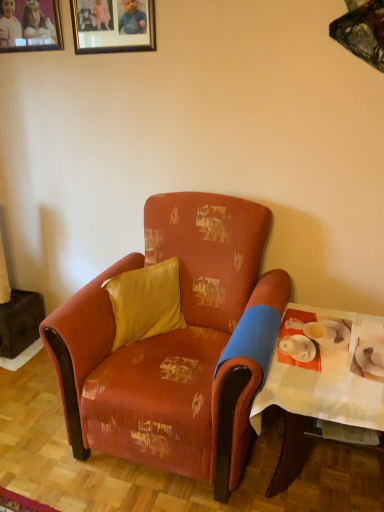
The width and height of the screenshot is (384, 512). Describe the element at coordinates (113, 25) in the screenshot. I see `gold-framed picture at upper center, marked as the 1th picture frame in a right-to-left arrangement` at that location.

The height and width of the screenshot is (512, 384). What do you see at coordinates (145, 302) in the screenshot?
I see `satin yellow pillow at center` at bounding box center [145, 302].

The image size is (384, 512). Identify the location of white paper table at right. click(x=322, y=387).

This screenshot has width=384, height=512. What are the coordinates of `gold-framed picture at upper center, marked as the 1th picture frame in a right-to-left arrangement` in the screenshot? It's located at (113, 25).

Would you say satin yellow pillow at center is inside or outside distressed fabric armchair at center?

satin yellow pillow at center fits inside distressed fabric armchair at center.

Which of these two, satin yellow pillow at center or distressed fabric armchair at center, is bigger?

distressed fabric armchair at center is bigger.

From the picture: Is distressed fabric armchair at center at the back of satin yellow pillow at center?

That's right, satin yellow pillow at center is facing away from distressed fabric armchair at center.

Looking at this image, between satin yellow pillow at center and distressed fabric armchair at center, which one has smaller width?

satin yellow pillow at center.

Which of these two, gold-framed picture at upper center, marked as the 1th picture frame in a right-to-left arrangement, or white paper table at right, is bigger?

white paper table at right is bigger.

Which is more to the right, gold-framed picture at upper center, marked as the 1th picture frame in a right-to-left arrangement, or white paper table at right?

From the viewer's perspective, white paper table at right appears more on the right side.

Is gold-framed picture at upper center, marked as the 1th picture frame in a right-to-left arrangement, taller or shorter than white paper table at right?

gold-framed picture at upper center, marked as the 1th picture frame in a right-to-left arrangement, is shorter than white paper table at right.

Which of these two, gold-framed picture at upper center, marked as the 1th picture frame in a right-to-left arrangement, or distressed fabric armchair at center, is wider?

With larger width is distressed fabric armchair at center.

Image resolution: width=384 pixels, height=512 pixels. Find the location of `the 1st picture frame behind when counting from the distressed fabric armchair at center`. the 1st picture frame behind when counting from the distressed fabric armchair at center is located at coordinates (113, 25).

Would you say distressed fabric armchair at center is part of gold-framed picture at upper center, marked as the 1th picture frame in a right-to-left arrangement,'s contents?

That's incorrect, distressed fabric armchair at center is not inside gold-framed picture at upper center, marked as the 1th picture frame in a right-to-left arrangement.

Does gold-framed picture at upper center, placed as the 2th picture frame when sorted from left to right, appear on the left side of distressed fabric armchair at center?

Yes.

From the image's perspective, which is above, matte wooden picture frame at upper left, the 1th picture frame when ordered from left to right, or distressed fabric armchair at center?

matte wooden picture frame at upper left, the 1th picture frame when ordered from left to right, is shown above in the image.

Identify the location of the 2nd picture frame behind the distressed fabric armchair at center, starting your count from the anchor. (30, 26).

Which object is closer to the camera taking this photo, matte wooden picture frame at upper left, arranged as the second picture frame when viewed from the right, or distressed fabric armchair at center?

distressed fabric armchair at center.

Does matte wooden picture frame at upper left, the 1th picture frame when ordered from left to right, turn towards distressed fabric armchair at center?

No, matte wooden picture frame at upper left, the 1th picture frame when ordered from left to right, is not facing towards distressed fabric armchair at center.

Can you confirm if white paper table at right is wider than gold-framed picture at upper center, marked as the 1th picture frame in a right-to-left arrangement?

Correct, the width of white paper table at right exceeds that of gold-framed picture at upper center, marked as the 1th picture frame in a right-to-left arrangement.

From the image's perspective, who appears lower, white paper table at right or gold-framed picture at upper center, marked as the 1th picture frame in a right-to-left arrangement?

white paper table at right, from the image's perspective.

Looking at this image, is white paper table at right at the left side of gold-framed picture at upper center, placed as the 2th picture frame when sorted from left to right?

In fact, white paper table at right is to the right of gold-framed picture at upper center, placed as the 2th picture frame when sorted from left to right.

Relative to gold-framed picture at upper center, marked as the 1th picture frame in a right-to-left arrangement, is satin yellow pillow at center in front or behind?

satin yellow pillow at center is in front of gold-framed picture at upper center, marked as the 1th picture frame in a right-to-left arrangement.

Does satin yellow pillow at center turn towards gold-framed picture at upper center, marked as the 1th picture frame in a right-to-left arrangement?

No, satin yellow pillow at center does not turn towards gold-framed picture at upper center, marked as the 1th picture frame in a right-to-left arrangement.

Is satin yellow pillow at center taller or shorter than gold-framed picture at upper center, marked as the 1th picture frame in a right-to-left arrangement?

In the image, satin yellow pillow at center appears to be shorter than gold-framed picture at upper center, marked as the 1th picture frame in a right-to-left arrangement.

Does satin yellow pillow at center have a greater width compared to gold-framed picture at upper center, marked as the 1th picture frame in a right-to-left arrangement?

Correct, the width of satin yellow pillow at center exceeds that of gold-framed picture at upper center, marked as the 1th picture frame in a right-to-left arrangement.

Measure the distance from matte wooden picture frame at upper left, the 1th picture frame when ordered from left to right, to white paper table at right.

The distance of matte wooden picture frame at upper left, the 1th picture frame when ordered from left to right, from white paper table at right is 2.00 meters.

The width and height of the screenshot is (384, 512). I want to click on table located underneath the matte wooden picture frame at upper left, arranged as the second picture frame when viewed from the right (from a real-world perspective), so [322, 387].

Which of these two, matte wooden picture frame at upper left, arranged as the second picture frame when viewed from the right, or white paper table at right, is smaller?

matte wooden picture frame at upper left, arranged as the second picture frame when viewed from the right.

Does matte wooden picture frame at upper left, arranged as the second picture frame when viewed from the right, have a greater height compared to white paper table at right?

In fact, matte wooden picture frame at upper left, arranged as the second picture frame when viewed from the right, may be shorter than white paper table at right.

Locate an element on the screen. Image resolution: width=384 pixels, height=512 pixels. pillow to the left of distressed fabric armchair at center is located at coordinates (145, 302).

Locate an element on the screen. table that appears in front of the gold-framed picture at upper center, placed as the 2th picture frame when sorted from left to right is located at coordinates (322, 387).

Based on their spatial positions, is matte wooden picture frame at upper left, arranged as the second picture frame when viewed from the right, or gold-framed picture at upper center, placed as the 2th picture frame when sorted from left to right, closer to satin yellow pillow at center?

gold-framed picture at upper center, placed as the 2th picture frame when sorted from left to right, is closer to satin yellow pillow at center.

Based on their spatial positions, is matte wooden picture frame at upper left, the 1th picture frame when ordered from left to right, or satin yellow pillow at center further from white paper table at right?

matte wooden picture frame at upper left, the 1th picture frame when ordered from left to right, lies further to white paper table at right than the other object.

Considering their positions, is matte wooden picture frame at upper left, the 1th picture frame when ordered from left to right, positioned closer to satin yellow pillow at center than white paper table at right?

white paper table at right.

Estimate the real-world distances between objects in this image. Which object is further from gold-framed picture at upper center, marked as the 1th picture frame in a right-to-left arrangement, satin yellow pillow at center or matte wooden picture frame at upper left, arranged as the second picture frame when viewed from the right?

satin yellow pillow at center is positioned further to the anchor gold-framed picture at upper center, marked as the 1th picture frame in a right-to-left arrangement.

Which object lies further to the anchor point distressed fabric armchair at center, satin yellow pillow at center or white paper table at right?

white paper table at right lies further to distressed fabric armchair at center than the other object.

When comparing their distances from gold-framed picture at upper center, marked as the 1th picture frame in a right-to-left arrangement, does white paper table at right or matte wooden picture frame at upper left, the 1th picture frame when ordered from left to right, seem closer?

The object closer to gold-framed picture at upper center, marked as the 1th picture frame in a right-to-left arrangement, is matte wooden picture frame at upper left, the 1th picture frame when ordered from left to right.

Based on their spatial positions, is distressed fabric armchair at center or gold-framed picture at upper center, placed as the 2th picture frame when sorted from left to right, further from white paper table at right?

Among the two, gold-framed picture at upper center, placed as the 2th picture frame when sorted from left to right, is located further to white paper table at right.

Considering their positions, is satin yellow pillow at center positioned closer to white paper table at right than gold-framed picture at upper center, marked as the 1th picture frame in a right-to-left arrangement?

satin yellow pillow at center.

Locate an element on the screen. This screenshot has height=512, width=384. pillow between gold-framed picture at upper center, marked as the 1th picture frame in a right-to-left arrangement, and white paper table at right from top to bottom is located at coordinates (145, 302).

You are a GUI agent. You are given a task and a screenshot of the screen. Output one action in this format:
    pyautogui.click(x=<x>, y=<y>)
    Task: Click on the pillow between matte wooden picture frame at upper left, arranged as the second picture frame when viewed from the right, and white paper table at right in the up-down direction
    The image size is (384, 512).
    Given the screenshot: What is the action you would take?
    pyautogui.click(x=145, y=302)

The width and height of the screenshot is (384, 512). In order to click on chair between matte wooden picture frame at upper left, the 1th picture frame when ordered from left to right, and white paper table at right from top to bottom in this screenshot , I will do pos(174,342).

Find the location of `chair between gold-framed picture at upper center, placed as the 2th picture frame when sorted from left to right, and white paper table at right from top to bottom`. chair between gold-framed picture at upper center, placed as the 2th picture frame when sorted from left to right, and white paper table at right from top to bottom is located at coordinates (174, 342).